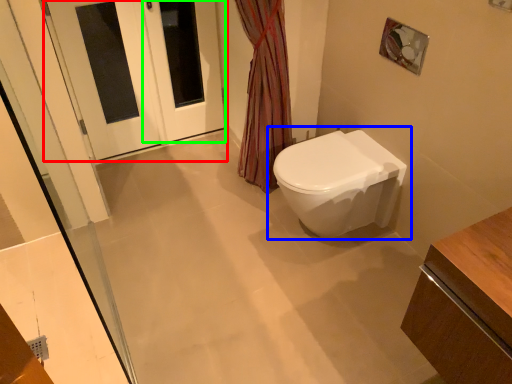
Question: Considering the real-world distances, which object is closest to door (highlighted by a red box)? toilet (highlighted by a blue box) or screen door (highlighted by a green box).

Choices:
 (A) toilet
 (B) screen door

Answer: (B)